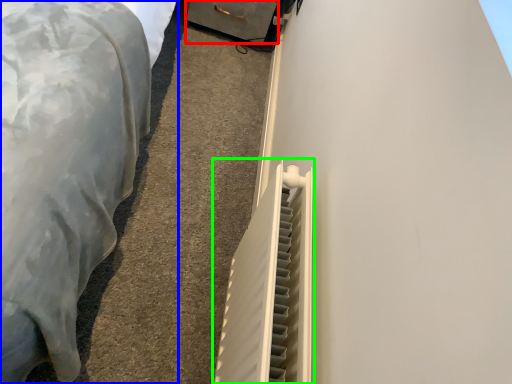
Question: Which object is positioned farthest from drawer (highlighted by a red box)? Select from furniture (highlighted by a blue box) and radiator (highlighted by a green box).

Choices:
 (A) furniture
 (B) radiator

Answer: (B)